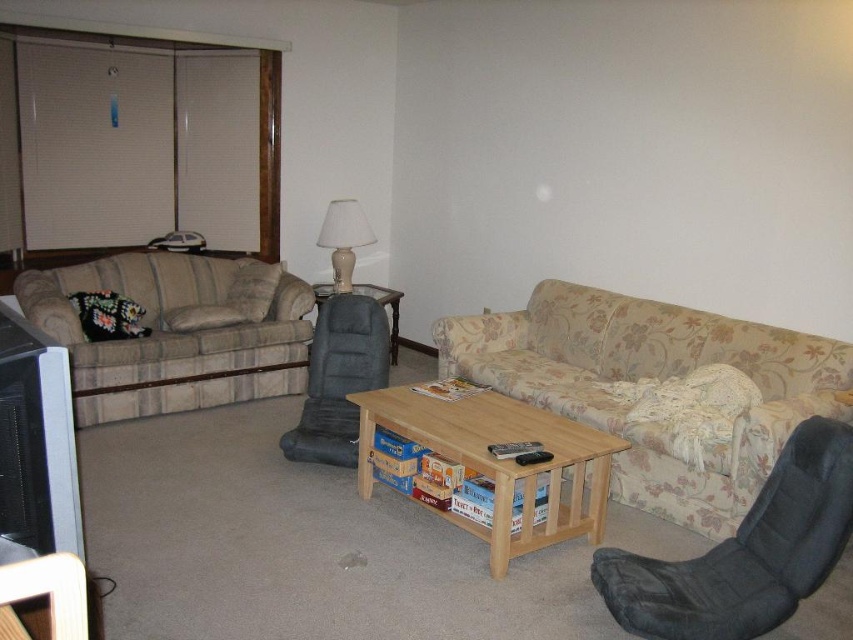
Question: Which object is closer to the camera taking this photo?

Choices:
 (A) floral fabric couch at center
 (B) white fabric lampshade at center

Answer: (A)

Question: Estimate the real-world distances between objects in this image. Which object is farther from the matte gray side table at center?

Choices:
 (A) light brown wooden coffee table at center
 (B) floral fabric couch at center
 (C) plaid fabric couch at left

Answer: (A)

Question: Estimate the real-world distances between objects in this image. Which object is closer to the matte gray side table at center?

Choices:
 (A) dark gray plush armchair at center
 (B) plaid fabric couch at left
 (C) white fabric lampshade at center
 (D) black fabric swivel chair at lower right

Answer: (C)

Question: Does floral fabric couch at center appear over black fabric swivel chair at lower right?

Choices:
 (A) yes
 (B) no

Answer: (A)

Question: Observing the image, what is the correct spatial positioning of floral fabric couch at center in reference to matte gray side table at center?

Choices:
 (A) below
 (B) above

Answer: (A)

Question: Does black fabric swivel chair at lower right appear under white fabric lampshade at center?

Choices:
 (A) yes
 (B) no

Answer: (A)